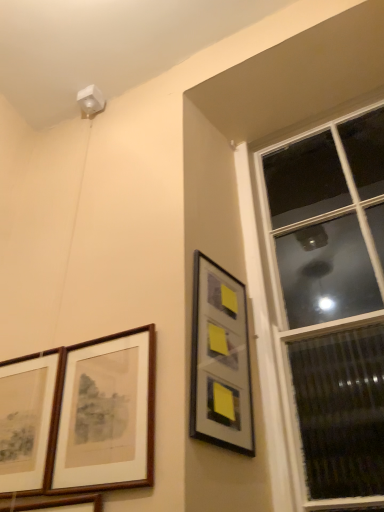
Question: Does transparent glass window at upper right appear on the left side of wooden framed picture at lower left, the second picture frame positioned from the left?

Choices:
 (A) no
 (B) yes

Answer: (A)

Question: Does transparent glass window at upper right have a greater height compared to wooden framed picture at lower left, the second picture frame positioned from the left?

Choices:
 (A) yes
 (B) no

Answer: (A)

Question: Can you confirm if transparent glass window at upper right is shorter than wooden framed picture at lower left, the second picture frame positioned from the left?

Choices:
 (A) no
 (B) yes

Answer: (A)

Question: Is transparent glass window at upper right closer to the viewer compared to wooden framed picture at lower left, placed as the 3th picture frame when sorted from right to left?

Choices:
 (A) yes
 (B) no

Answer: (B)

Question: From the image's perspective, is transparent glass window at upper right located above wooden framed picture at lower left, placed as the 3th picture frame when sorted from right to left?

Choices:
 (A) yes
 (B) no

Answer: (A)

Question: Based on their sizes in the image, would you say transparent glass window at upper right is bigger or smaller than wooden picture frame at lower left, the fourth picture frame when ordered from right to left?

Choices:
 (A) small
 (B) big

Answer: (B)

Question: Is transparent glass window at upper right taller or shorter than wooden picture frame at lower left, the fourth picture frame when ordered from right to left?

Choices:
 (A) tall
 (B) short

Answer: (A)

Question: Is transparent glass window at upper right situated inside wooden picture frame at lower left, which appears as the 1th picture frame when viewed from the left, or outside?

Choices:
 (A) inside
 (B) outside

Answer: (B)

Question: From the image's perspective, is transparent glass window at upper right positioned above or below wooden picture frame at lower left, which appears as the 1th picture frame when viewed from the left?

Choices:
 (A) above
 (B) below

Answer: (A)

Question: From the image's perspective, is wooden picture frame at lower left, which appears as the 1th picture frame when viewed from the left, located above or below transparent glass window at upper right?

Choices:
 (A) below
 (B) above

Answer: (A)

Question: Is wooden picture frame at lower left, the fourth picture frame when ordered from right to left, inside the boundaries of transparent glass window at upper right, or outside?

Choices:
 (A) outside
 (B) inside

Answer: (A)

Question: Looking at the image, does wooden picture frame at lower left, which appears as the 1th picture frame when viewed from the left, seem bigger or smaller compared to transparent glass window at upper right?

Choices:
 (A) big
 (B) small

Answer: (B)

Question: In terms of width, does wooden picture frame at lower left, the fourth picture frame when ordered from right to left, look wider or thinner when compared to transparent glass window at upper right?

Choices:
 (A) thin
 (B) wide

Answer: (A)

Question: In terms of width, does transparent glass window at upper right look wider or thinner when compared to brown wooden picture frame at lower left, the third picture frame in the left-to-right sequence?

Choices:
 (A) wide
 (B) thin

Answer: (A)

Question: Relative to brown wooden picture frame at lower left, the second picture frame positioned from the right, is transparent glass window at upper right in front or behind?

Choices:
 (A) front
 (B) behind

Answer: (A)